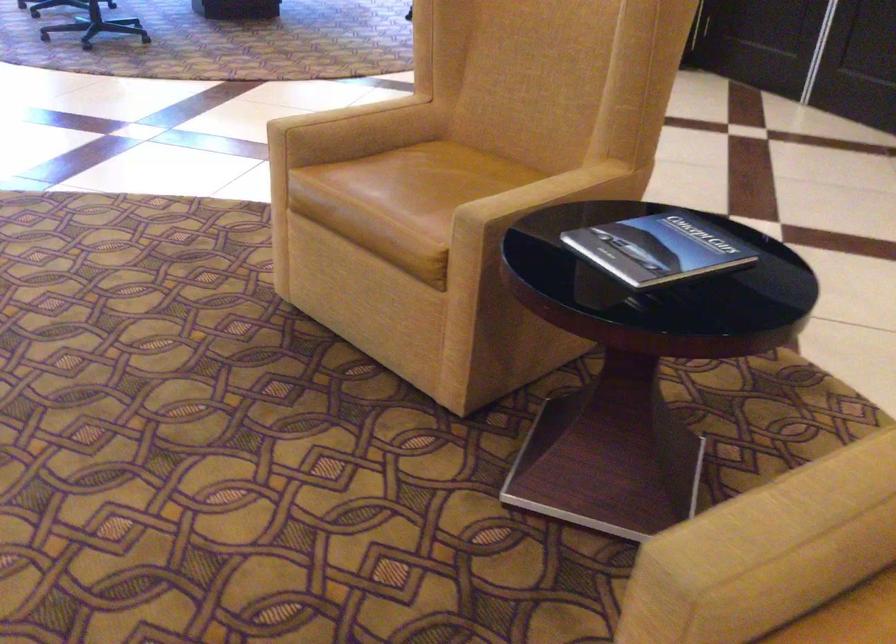
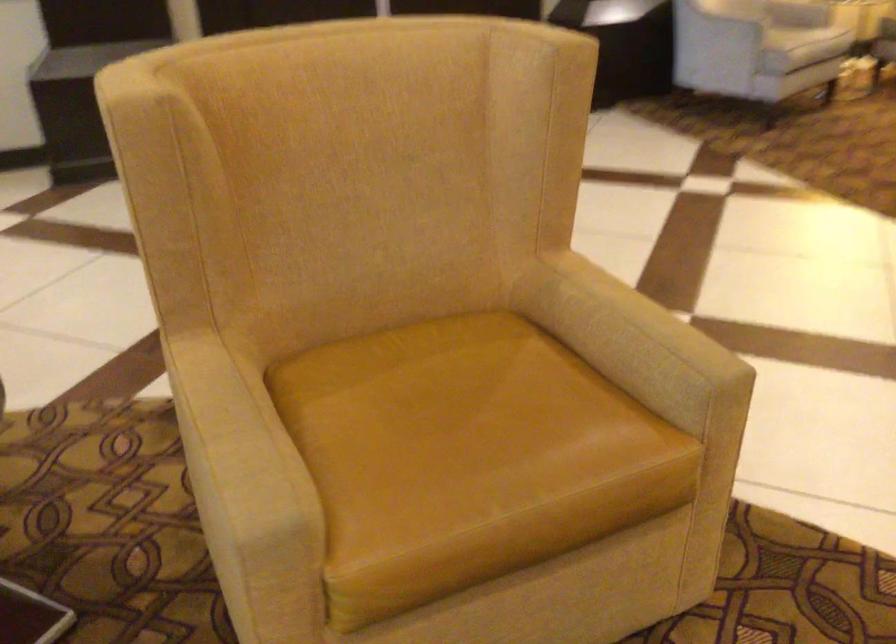
The images are taken continuously from a first-person perspective. In which direction is your viewpoint rotating?

The camera rotated toward right-down.